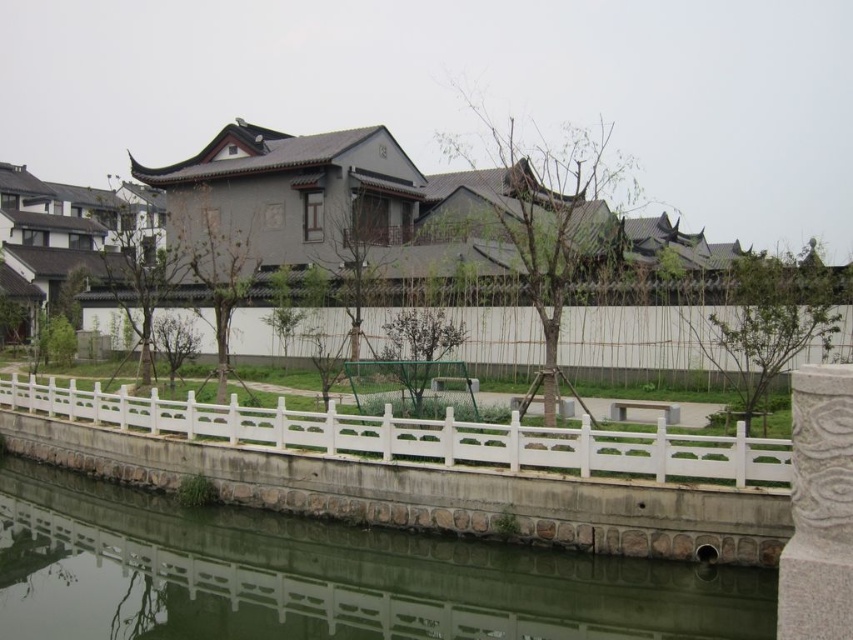
You are planning to install a decorative stone path between the smooth concrete river at lower center and the white plastic fence at lower center. Given their widths, which one should the path be closer to, and why?

The path should be closer to the smooth concrete river at lower center because it has a lesser width than the white plastic fence at lower center, allowing more space for the path near the wider fence.

You are a gardener planning to install a new pathway between the smooth concrete river at lower center and the white plastic fence at lower center. Which object takes up less space in the scene?

The smooth concrete river at lower center is smaller than the white plastic fence at lower center, so it takes up less space in the scene.

Based on the photo, you are a gardener planning to install a new decorative stone path between the smooth concrete river at lower center and the white plastic fence at lower center. Based on the scene, which object should the path be placed closer to in order to maintain proper elevation?

The smooth concrete river at lower center is taller than the white plastic fence at lower center, so the path should be placed closer to the white plastic fence at lower center to maintain proper elevation.